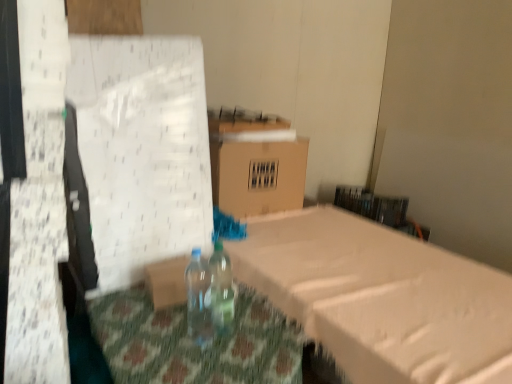
The image size is (512, 384). I want to click on free space to the left of translucent plastic bottle at center, which is the second bottle in right-to-left order, so click(166, 332).